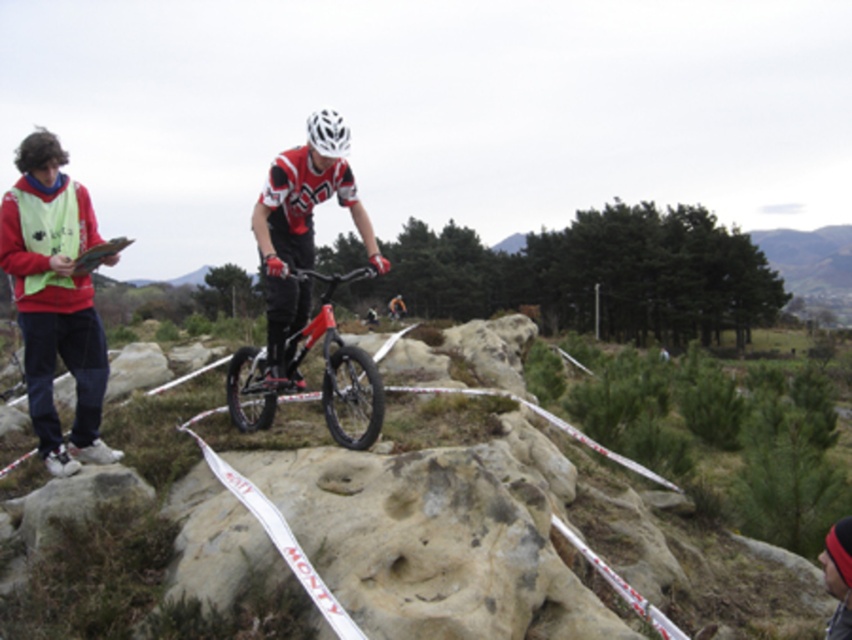
Is point (39, 172) behind point (347, 129)?

No, (39, 172) is in front of (347, 129).

Between point (3, 225) and point (341, 145), which one is positioned in front?

Point (3, 225)

Locate an element on the screen. Image resolution: width=852 pixels, height=640 pixels. matte black bicycle at center is located at coordinates (55, 300).

Is matte red bicycle at center taller than white matte bicycle helmet at center?

Incorrect, matte red bicycle at center's height is not larger of white matte bicycle helmet at center's.

Does matte red bicycle at center appear over white matte bicycle helmet at center?

Actually, matte red bicycle at center is below white matte bicycle helmet at center.

Between point (340, 412) and point (314, 112), which one is positioned behind?

The point (314, 112) is behind.

Locate an element on the screen. matte red bicycle at center is located at coordinates (321, 376).

Is matte black bicycle at center closer to the viewer compared to matte red bicycle at center?

No, it is not.

Does matte black bicycle at center appear on the left side of matte red bicycle at center?

Correct, you'll find matte black bicycle at center to the left of matte red bicycle at center.

Describe the element at coordinates (55, 300) in the screenshot. The image size is (852, 640). I see `matte black bicycle at center` at that location.

Find the location of a particular element. Image resolution: width=852 pixels, height=640 pixels. matte black bicycle at center is located at coordinates (55, 300).